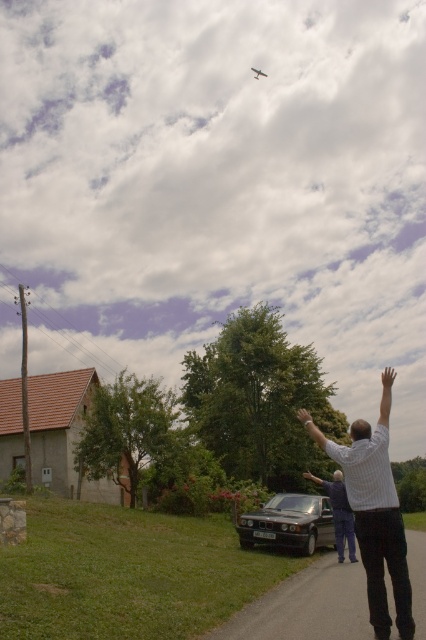
Can you confirm if white striped shirt at center is wider than smooth skin arm at center?

Correct, the width of white striped shirt at center exceeds that of smooth skin arm at center.

Does point (405, 609) come in front of point (305, 474)?

Yes, it is.

Does point (376, 612) come closer to viewer compared to point (310, 474)?

Yes, point (376, 612) is in front of point (310, 474).

The width and height of the screenshot is (426, 640). I want to click on white striped shirt at center, so click(x=374, y=513).

Is point (374, 545) positioned in front of point (252, 68)?

Yes, point (374, 545) is in front of point (252, 68).

What do you see at coordinates (374, 513) in the screenshot? I see `white striped shirt at center` at bounding box center [374, 513].

Does point (383, 556) lie in front of point (262, 74)?

Yes.

Where is `white striped shirt at center`? white striped shirt at center is located at coordinates (374, 513).

Can you confirm if black matte car at lower center is bigger than smooth skin arm at center?

Actually, black matte car at lower center might be smaller than smooth skin arm at center.

Does black matte car at lower center have a greater height compared to smooth skin arm at center?

No, black matte car at lower center is not taller than smooth skin arm at center.

Locate an element on the screen. The height and width of the screenshot is (640, 426). black matte car at lower center is located at coordinates (288, 524).